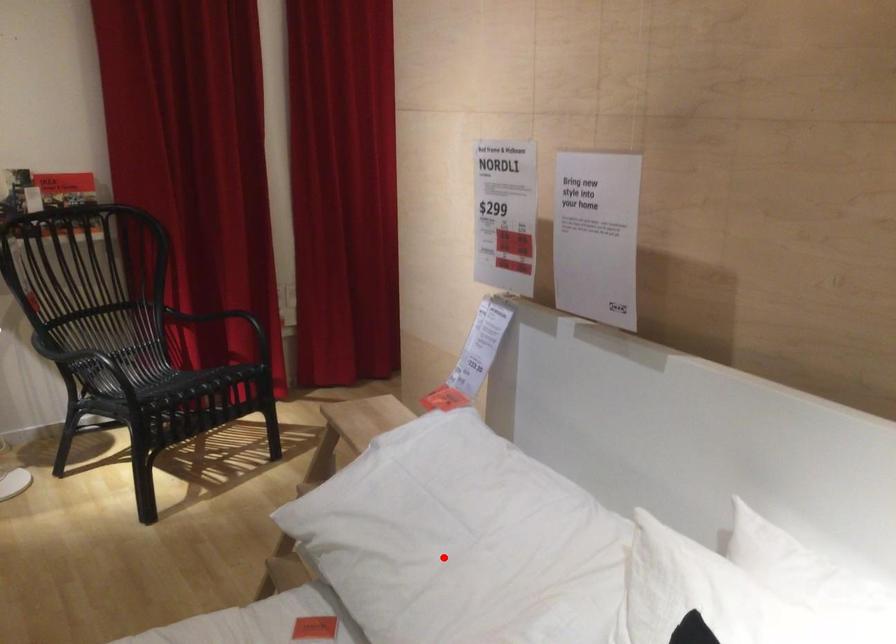
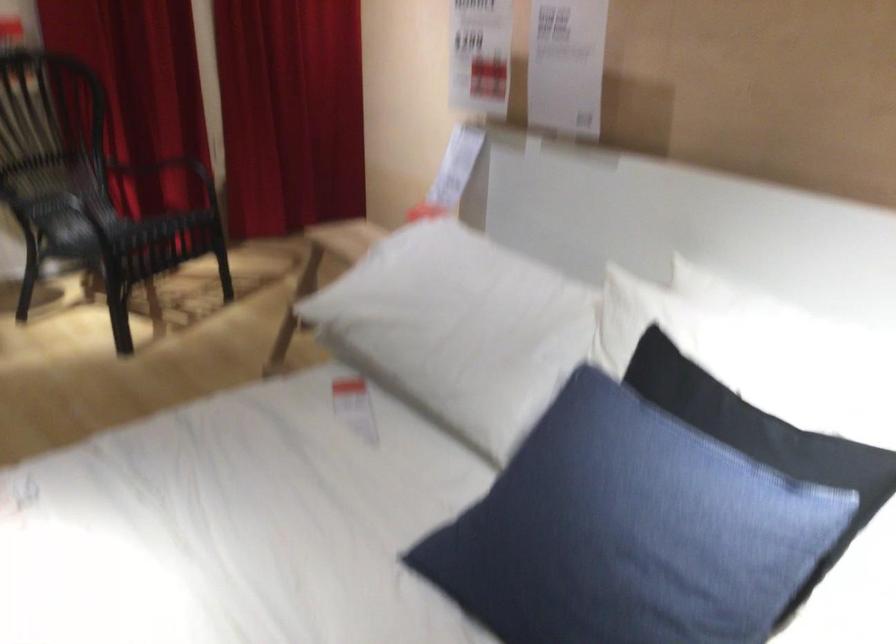
Question: I am providing you with two images of the same scene from different viewpoints. In image1, a red point is highlighted. Considering the same 3D point in image2, which of the following is correct?

Choices:
 (A) It is closer
 (B) It is farther

Answer: (B)